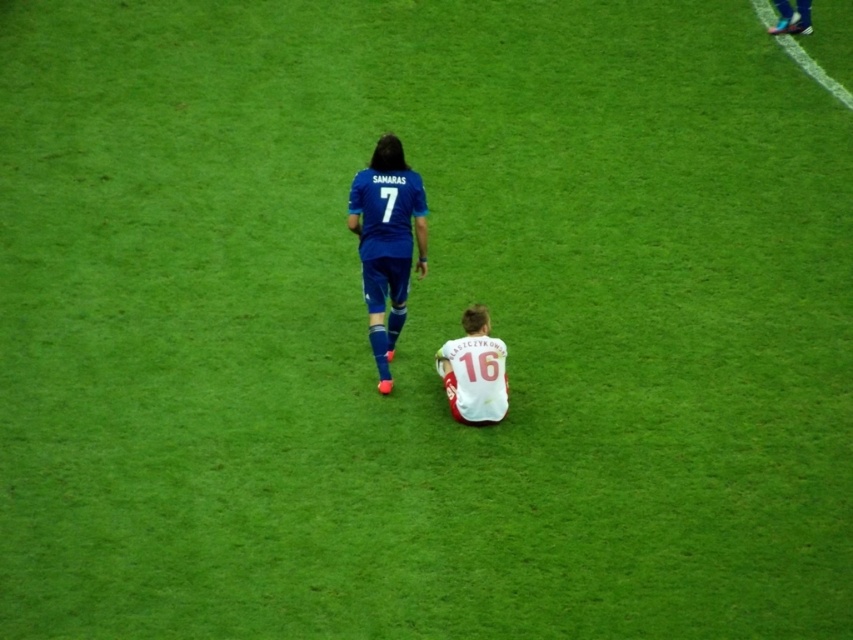
Is point (379, 170) farther from viewer compared to point (469, 314)?

Yes, point (379, 170) is behind point (469, 314).

Looking at this image, is blue matte soccer player at upper center wider than white jersey at center?

Correct, the width of blue matte soccer player at upper center exceeds that of white jersey at center.

Between point (397, 196) and point (462, 397), which one is positioned behind?

Point (397, 196)

Identify the location of blue matte soccer player at upper center. The image size is (853, 640). (387, 243).